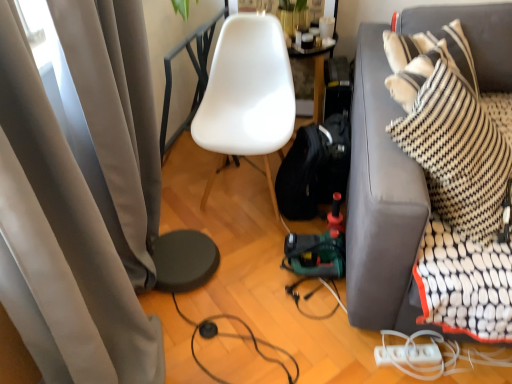
Where is `free location to the right of white plastic extension cord at lower right`? The height and width of the screenshot is (384, 512). free location to the right of white plastic extension cord at lower right is located at coordinates (452, 363).